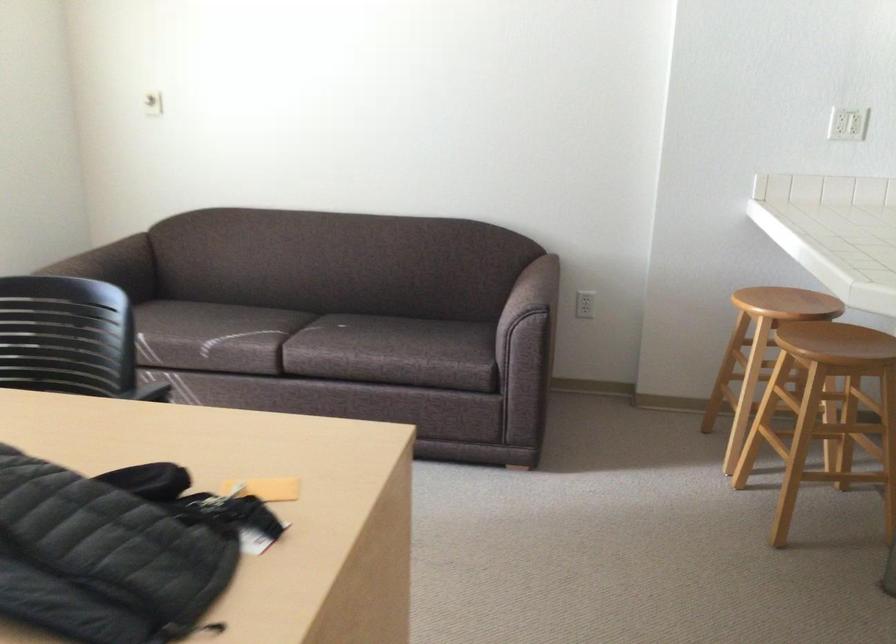
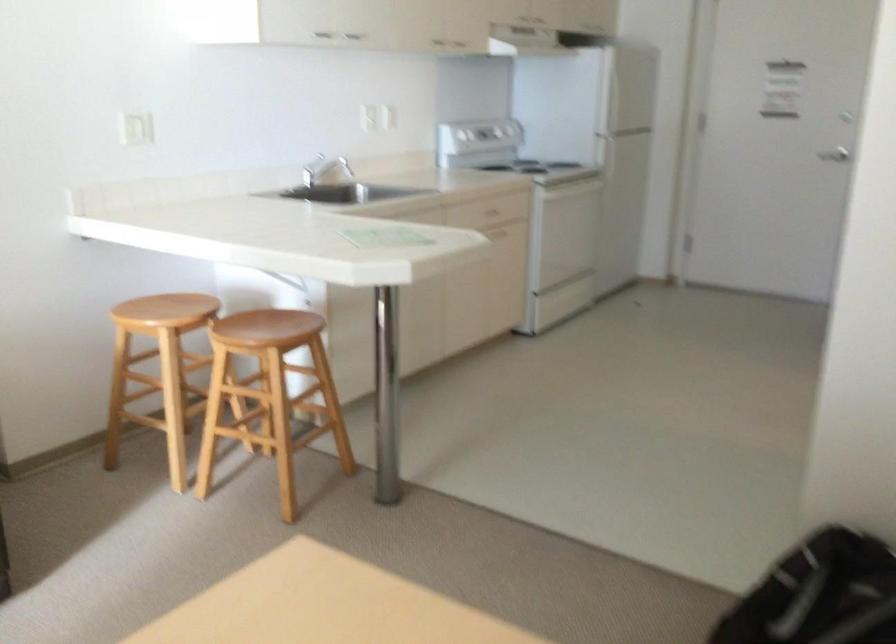
Where in the second image is the point corresponding to pixel 784 301 from the first image?

(165, 310)